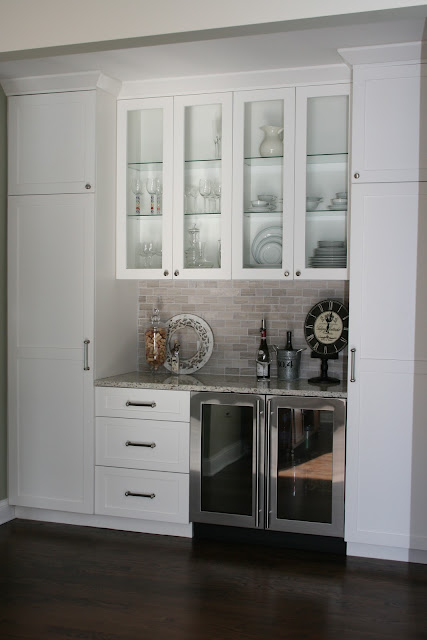
Find the location of `backsplash`. backsplash is located at coordinates (275, 317).